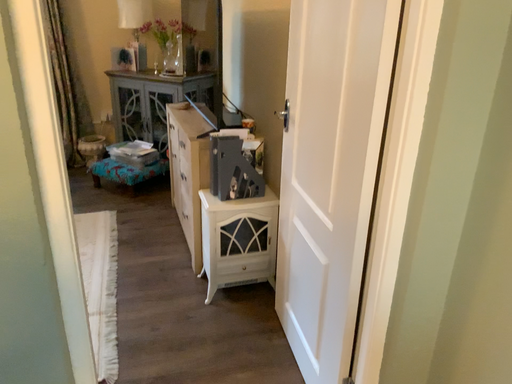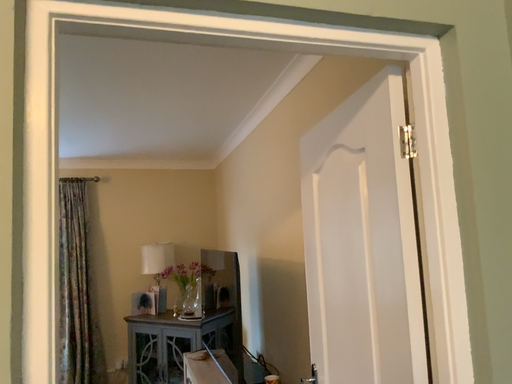
Question: Which way did the camera rotate in the video?

Choices:
 (A) rotated upward
 (B) rotated downward

Answer: (A)